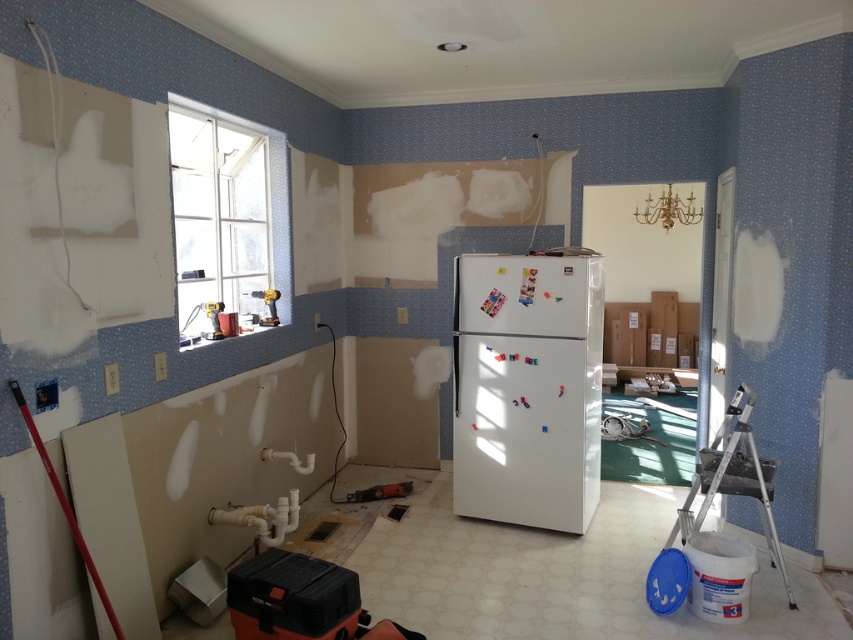
You are a contractor in the room and need to place a new appliance that is 2 meters tall. The white matte refrigerator at center is currently above the metallic orange power tool at center. Can the refrigerator be moved to make space for the appliance without disturbing the power tool?

The white matte refrigerator at center is currently above the metallic orange power tool at center. To move the refrigerator without disturbing the power tool, you would need to shift it sideways or reposition it in a way that maintains its vertical separation from the power tool. However, since the refrigerator is already above the power tool, there might be enough vertical clearance to slide it horizontally to another area of the room, provided there is sufficient space. Alternatively, if the appliance to

You are an interior designer inspecting the room. You need to move the silver metallic ladder at right to the corner to make space for the white matte refrigerator at center. Is the refrigerator currently blocking the ladder?

The white matte refrigerator at center is positioned over the silver metallic ladder at right, so yes, the refrigerator is blocking the ladder and needs to be moved first.

You are standing in the room depicted in the scene and want to reach the unfinished ceiling to install a light fixture. The ladder you see is the only one available. Can you safely reach the ceiling with the silver metallic ladder at right?

The silver metallic ladder at right is 2.93 meters away from viewer. Since the ladder is positioned at a safe distance, you can move towards it and use it to safely reach the ceiling for installing the light fixture.